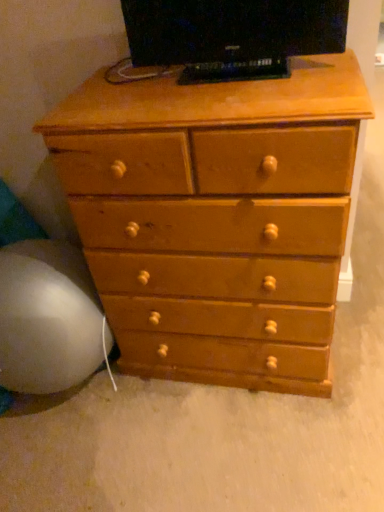
At what (x,y) coordinates should I click in order to perform the action: click on free space in front of matte black tv at upper center. Please return your answer as a coordinate pair (x, y). The width and height of the screenshot is (384, 512). Looking at the image, I should click on (251, 94).